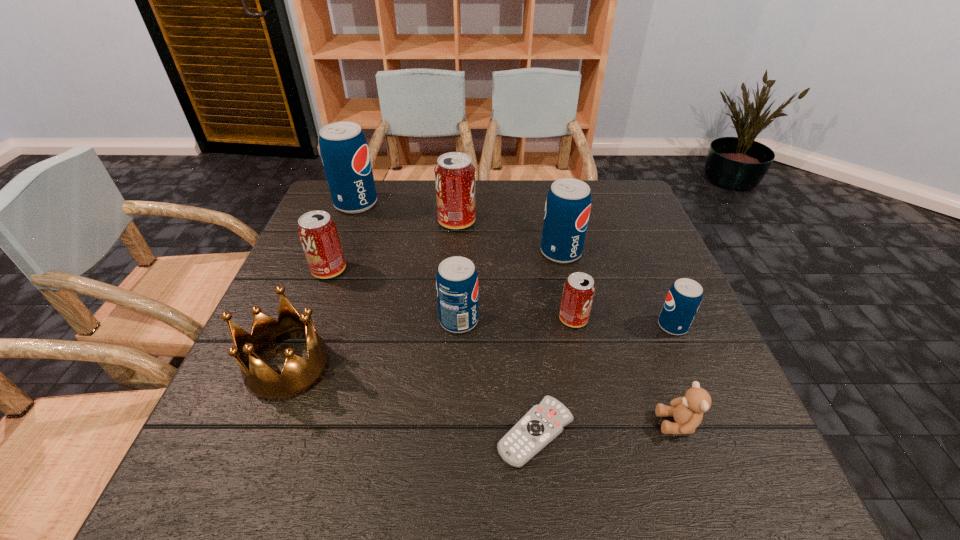
Find the location of a particular element. free space between the smallest blue pop and the crown is located at coordinates (480, 346).

At what (x,y) coordinates should I click in order to perform the action: click on free space between the remote control and the second smallest red soda can. Please return your answer as a coordinate pair (x, y). Looking at the image, I should click on (432, 351).

Locate an element on the screen. Image resolution: width=960 pixels, height=540 pixels. vacant region between the teddy bear and the biggest blue pop is located at coordinates (516, 314).

Locate an element on the screen. free space between the remote control and the smallest blue pop is located at coordinates (604, 379).

This screenshot has width=960, height=540. Identify the location of empty space that is in between the second shortest object and the crown. (483, 395).

Find the location of `free spot between the third biggest blue pop and the second blue pop from right to left`. free spot between the third biggest blue pop and the second blue pop from right to left is located at coordinates (510, 287).

Where is `free space between the third biggest blue pop and the shortest object`? free space between the third biggest blue pop and the shortest object is located at coordinates (497, 376).

Where is `object that is the eighth closest to the farthest red soda can`? object that is the eighth closest to the farthest red soda can is located at coordinates (542, 423).

Locate an element on the screen. object that is the sixth nearest to the shortest object is located at coordinates (567, 209).

The height and width of the screenshot is (540, 960). What are the coordinates of `pop that stands as the sixth closest to the third blue pop from right to left` in the screenshot? It's located at (344, 150).